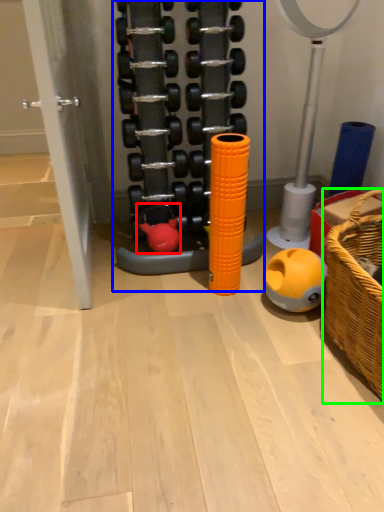
Question: Which is nearer to the toy (highlighted by a red box)? toy (highlighted by a blue box) or basket (highlighted by a green box).

Choices:
 (A) toy
 (B) basket

Answer: (A)